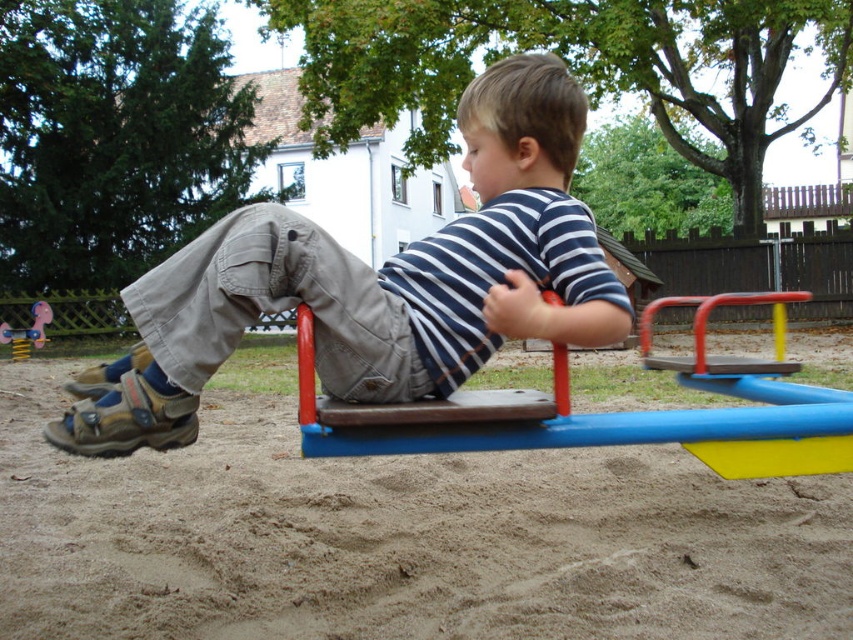
Question: Is brown sandy ground at center bigger than matte plastic toy horse at lower left?

Choices:
 (A) no
 (B) yes

Answer: (A)

Question: Which of the following is the farthest from the observer?

Choices:
 (A) brown sandy ground at center
 (B) matte plastic toy horse at lower left
 (C) matte khaki pants at center
 (D) brown leather bench at center

Answer: (B)

Question: Which point is farther to the camera?

Choices:
 (A) brown leather bench at center
 (B) matte khaki pants at center

Answer: (A)

Question: Is brown sandy ground at center above matte khaki pants at center?

Choices:
 (A) yes
 (B) no

Answer: (B)

Question: Which is farther from the brown sandy ground at center?

Choices:
 (A) matte plastic toy horse at lower left
 (B) brown leather bench at center
 (C) matte khaki pants at center

Answer: (A)

Question: Can you confirm if matte khaki pants at center is positioned above matte plastic toy horse at lower left?

Choices:
 (A) yes
 (B) no

Answer: (A)